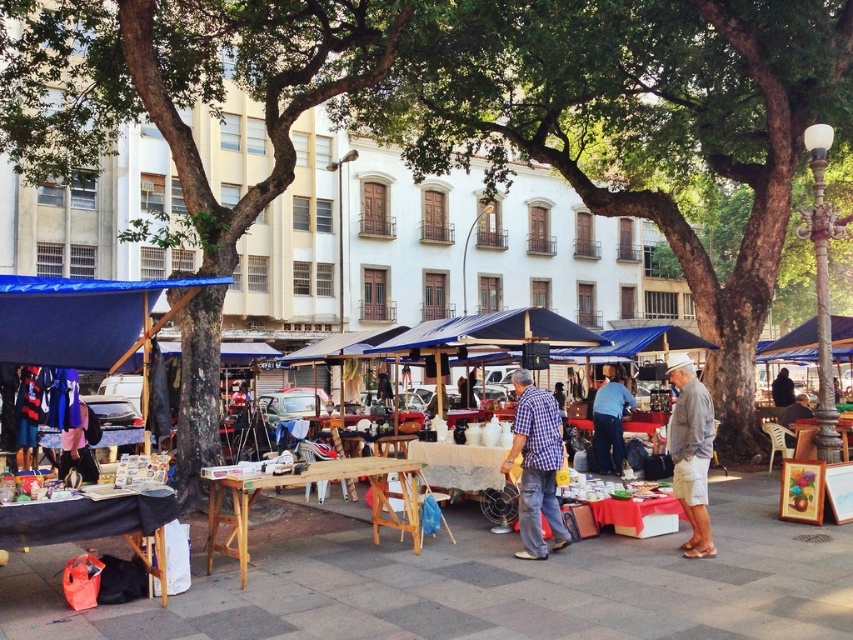
Which is below, blue fabric bag at center or dark brown leather jacket at lower right?

Positioned lower is blue fabric bag at center.

Can you confirm if blue fabric bag at center is positioned to the left of dark brown leather jacket at lower right?

Indeed, blue fabric bag at center is positioned on the left side of dark brown leather jacket at lower right.

Between point (614, 413) and point (778, 376), which one is positioned behind?

The point (778, 376) is more distant.

The width and height of the screenshot is (853, 640). I want to click on blue fabric bag at center, so click(x=608, y=422).

Who is positioned more to the left, green leafy tree at center or gray cotton shirt at center?

gray cotton shirt at center is more to the left.

In the scene shown: Does green leafy tree at center have a larger size compared to gray cotton shirt at center?

Yes.

In the scene shown: Who is more distant from viewer, (711, 108) or (706, 458)?

The point (711, 108) is more distant.

You are a GUI agent. You are given a task and a screenshot of the screen. Output one action in this format:
    pyautogui.click(x=<x>, y=<y>)
    Task: Click on the green leafy tree at center
    
    Given the screenshot: What is the action you would take?
    pyautogui.click(x=640, y=128)

Is blue fabric canopy at left taller than smooth wooden table at center?

Correct, blue fabric canopy at left is much taller as smooth wooden table at center.

Does blue fabric canopy at left have a greater width compared to smooth wooden table at center?

Correct, the width of blue fabric canopy at left exceeds that of smooth wooden table at center.

Does point (164, 320) come behind point (799, 401)?

No.

I want to click on blue fabric canopy at left, so click(82, 317).